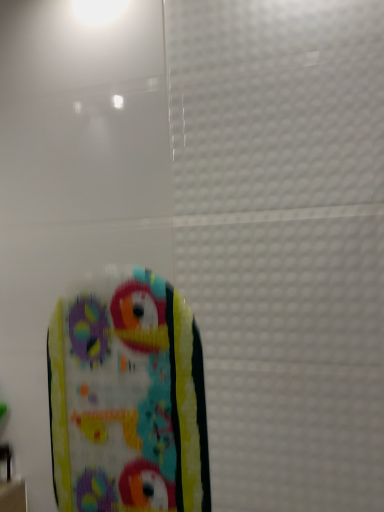
What do you see at coordinates (127, 397) in the screenshot?
I see `multicolored fabric towel at lower left` at bounding box center [127, 397].

You are a GUI agent. You are given a task and a screenshot of the screen. Output one action in this format:
    pyautogui.click(x=<x>, y=<y>)
    Task: Click on the multicolored fabric towel at lower left
    The width and height of the screenshot is (384, 512).
    Given the screenshot: What is the action you would take?
    pyautogui.click(x=127, y=397)

What is the approximate height of multicolored fabric towel at lower left?

multicolored fabric towel at lower left is 56.88 centimeters tall.

The height and width of the screenshot is (512, 384). I want to click on multicolored fabric towel at lower left, so [127, 397].